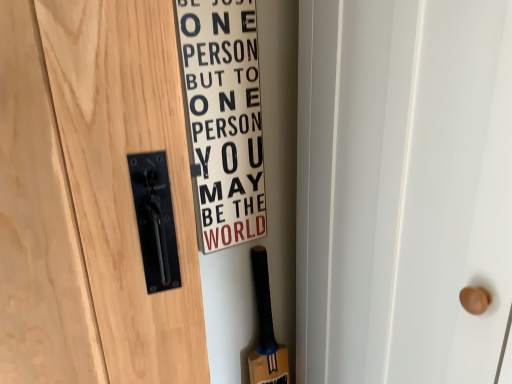
Question: From a real-world perspective, does white matte sign at center sit lower than black rubber baseball bat at lower right?

Choices:
 (A) yes
 (B) no

Answer: (B)

Question: Does white matte sign at center have a larger size compared to black rubber baseball bat at lower right?

Choices:
 (A) yes
 (B) no

Answer: (B)

Question: Does white matte sign at center contain black rubber baseball bat at lower right?

Choices:
 (A) no
 (B) yes

Answer: (A)

Question: Is white matte sign at center not within black rubber baseball bat at lower right?

Choices:
 (A) no
 (B) yes

Answer: (B)

Question: Is white matte sign at center shorter than black rubber baseball bat at lower right?

Choices:
 (A) no
 (B) yes

Answer: (A)

Question: Does white matte sign at center have a lesser width compared to black rubber baseball bat at lower right?

Choices:
 (A) no
 (B) yes

Answer: (B)

Question: From a real-world perspective, is black rubber baseball bat at lower right positioned over white matte sign at center based on gravity?

Choices:
 (A) no
 (B) yes

Answer: (A)

Question: Can you confirm if black rubber baseball bat at lower right is taller than white matte sign at center?

Choices:
 (A) yes
 (B) no

Answer: (B)

Question: Considering the relative sizes of black rubber baseball bat at lower right and white matte sign at center in the image provided, is black rubber baseball bat at lower right bigger than white matte sign at center?

Choices:
 (A) no
 (B) yes

Answer: (B)

Question: From the image's perspective, would you say black rubber baseball bat at lower right is shown under white matte sign at center?

Choices:
 (A) no
 (B) yes

Answer: (B)

Question: Is black rubber baseball bat at lower right far away from white matte sign at center?

Choices:
 (A) no
 (B) yes

Answer: (A)

Question: Does black rubber baseball bat at lower right appear on the right side of white matte sign at center?

Choices:
 (A) yes
 (B) no

Answer: (A)

Question: Considering the positions of white matte sign at center and black rubber baseball bat at lower right in the image, is white matte sign at center taller or shorter than black rubber baseball bat at lower right?

Choices:
 (A) short
 (B) tall

Answer: (B)